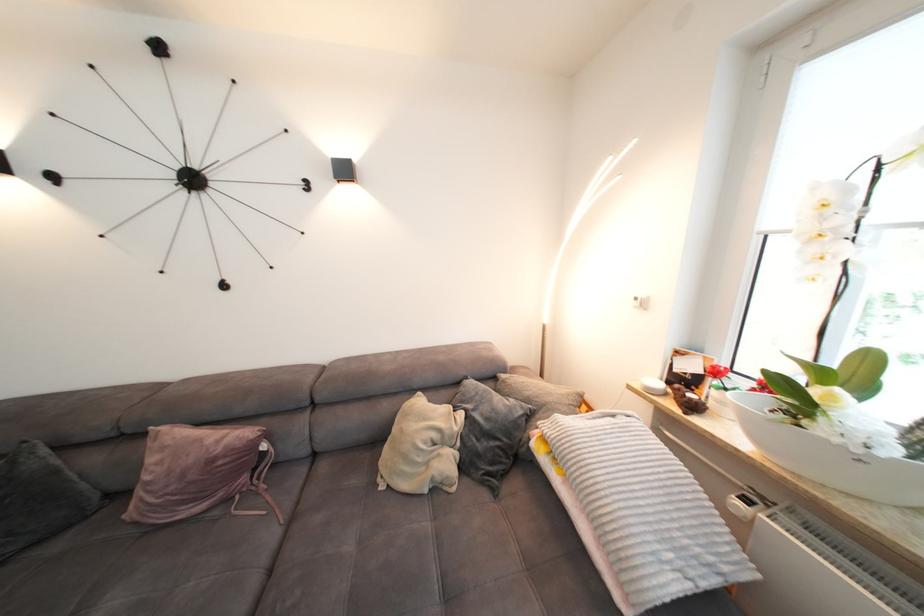
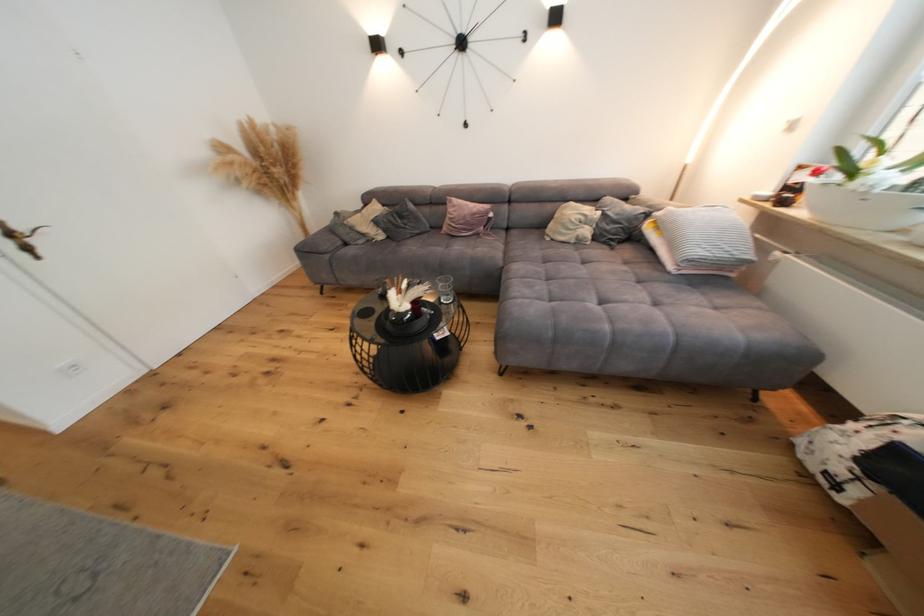
Find the pixel in the second image that matches point (696, 368) in the first image.

(809, 179)